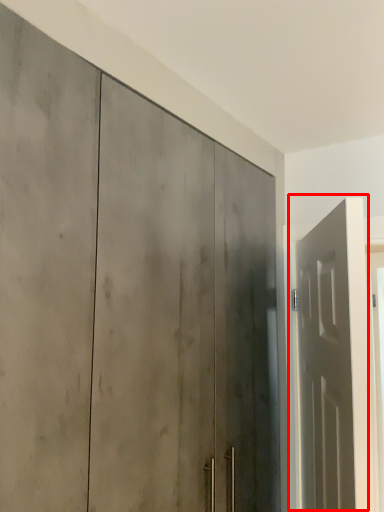
Question: Where is door (annotated by the red box) located in relation to door in the image?

Choices:
 (A) left
 (B) right

Answer: (B)